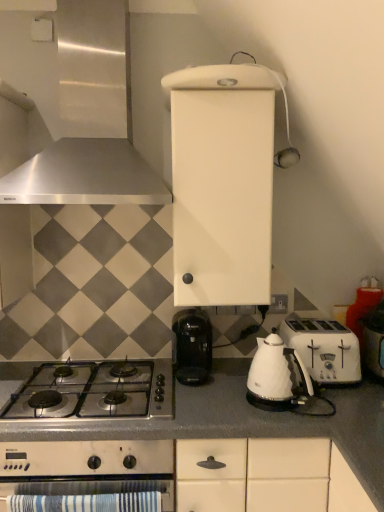
Question: Is white plastic toaster at right placed right next to white plastic toaster at right?

Choices:
 (A) yes
 (B) no

Answer: (B)

Question: Is white plastic toaster at right bigger than white plastic toaster at right?

Choices:
 (A) yes
 (B) no

Answer: (A)

Question: Is white plastic toaster at right oriented away from white plastic toaster at right?

Choices:
 (A) no
 (B) yes

Answer: (A)

Question: Is white plastic toaster at right positioned far away from white plastic toaster at right?

Choices:
 (A) yes
 (B) no

Answer: (B)

Question: Is white plastic toaster at right aimed at white plastic toaster at right?

Choices:
 (A) yes
 (B) no

Answer: (B)

Question: Is point (274, 307) positioned closer to the camera than point (301, 361)?

Choices:
 (A) closer
 (B) farther

Answer: (B)

Question: Is white plastic electric outlet at center-right taller or shorter than white glossy kettle at lower center?

Choices:
 (A) short
 (B) tall

Answer: (A)

Question: In the image, is white plastic electric outlet at center-right positioned in front of or behind white glossy kettle at lower center?

Choices:
 (A) behind
 (B) front

Answer: (A)

Question: Considering the positions of white plastic electric outlet at center-right and white glossy kettle at lower center in the image, is white plastic electric outlet at center-right wider or thinner than white glossy kettle at lower center?

Choices:
 (A) wide
 (B) thin

Answer: (B)

Question: Is point (119, 32) closer or farther from the camera than point (289, 394)?

Choices:
 (A) closer
 (B) farther

Answer: (B)

Question: Would you say satin silver range hood at upper left is to the left or to the right of white glossy kettle at lower center in the picture?

Choices:
 (A) left
 (B) right

Answer: (A)

Question: Considering the positions of satin silver range hood at upper left and white glossy kettle at lower center in the image, is satin silver range hood at upper left taller or shorter than white glossy kettle at lower center?

Choices:
 (A) tall
 (B) short

Answer: (A)

Question: Looking at their shapes, would you say satin silver range hood at upper left is wider or thinner than white glossy kettle at lower center?

Choices:
 (A) thin
 (B) wide

Answer: (B)

Question: From the image's perspective, relative to white plastic toaster at right, is stainless steel gas stove at lower left above or below?

Choices:
 (A) above
 (B) below

Answer: (B)

Question: Considering the positions of stainless steel gas stove at lower left and white plastic toaster at right in the image, is stainless steel gas stove at lower left wider or thinner than white plastic toaster at right?

Choices:
 (A) wide
 (B) thin

Answer: (A)